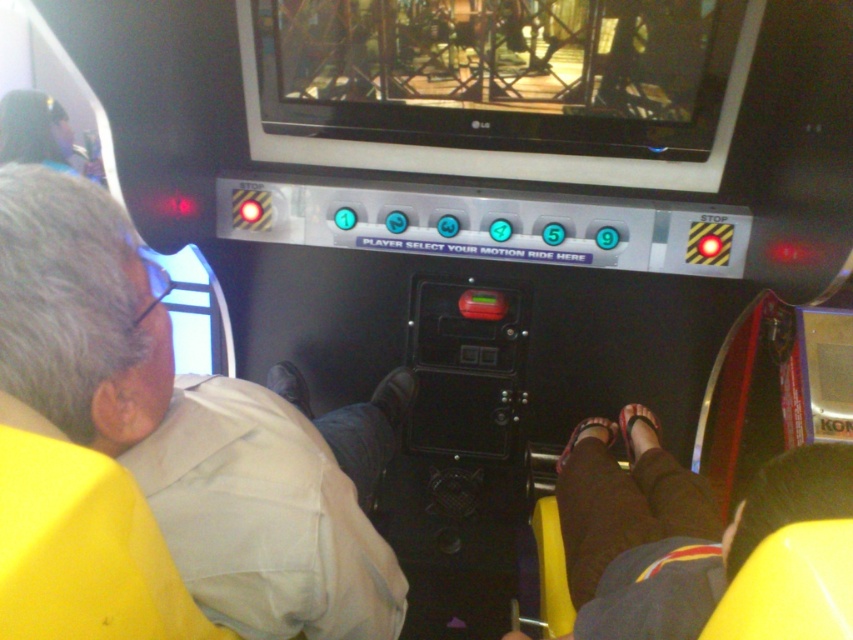
You are standing in front of the motion ride control panel and notice a matte pink sandal at lower center. If you want to reach it without moving your feet, can you do so with your arm?

The distance between you and the matte pink sandal at lower center is 1.73 meters, which is greater than the average human arm length of around 0.7 meters. Therefore, you cannot reach the matte pink sandal at lower center without moving your feet.

You are a ride operator checking the control panel. There are two points on the panel at coordinates point (398, 589) and point (648, 428). Which point is closer to the camera?

Point (398, 589) is closer to the camera than point (648, 428).